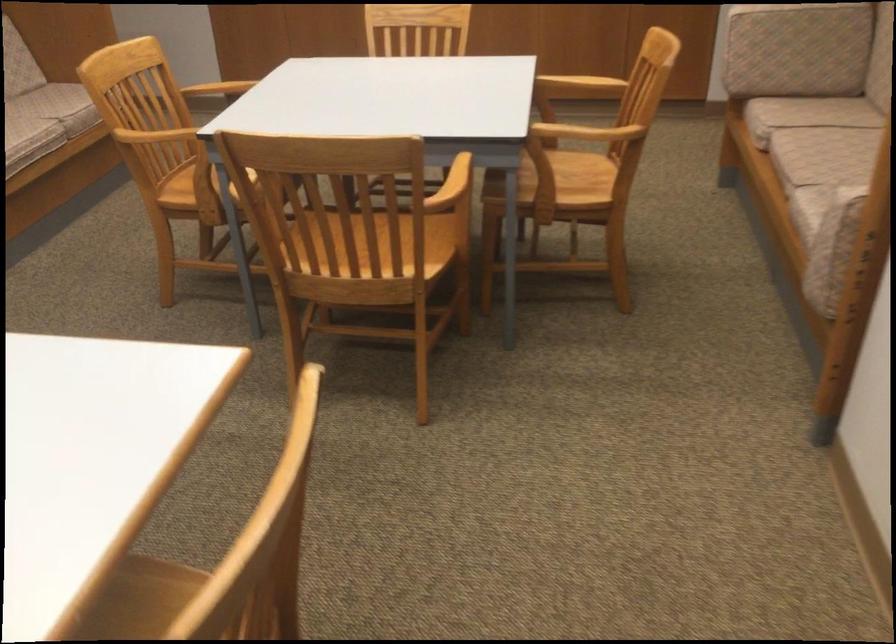
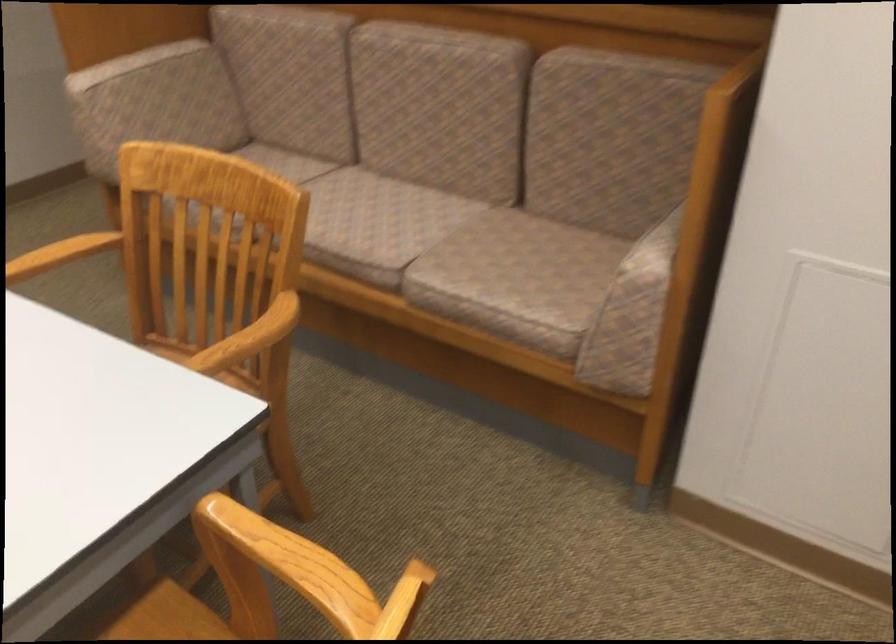
Locate, in the second image, the point that corresponds to pixel 518 192 in the first image.

(259, 498)